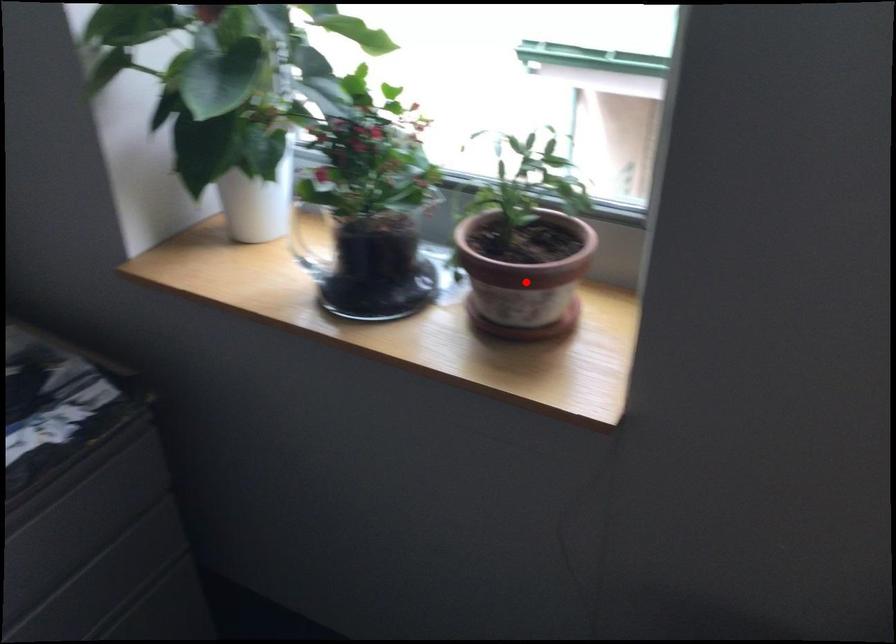
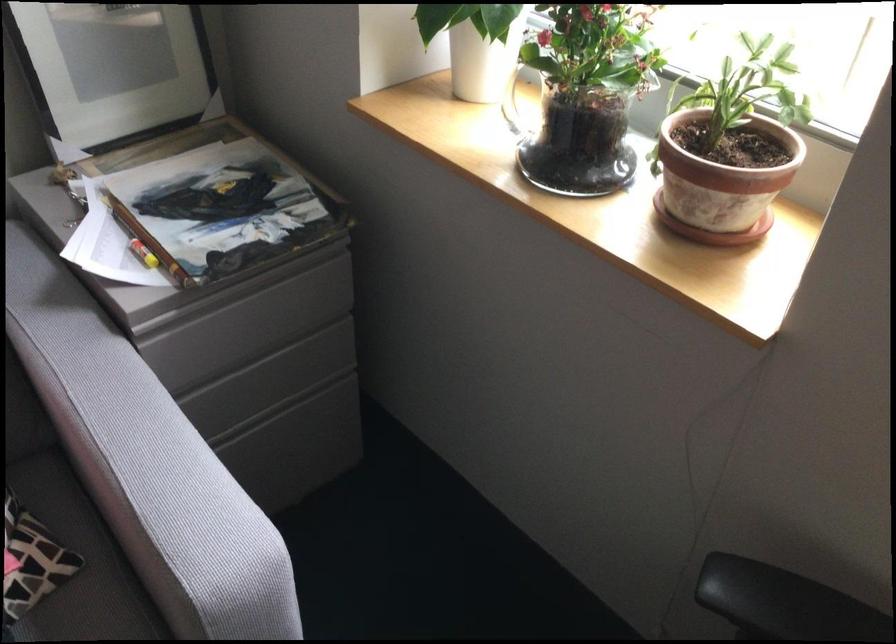
In the second image, find the point that corresponds to the highlighted location in the first image.

(721, 184)